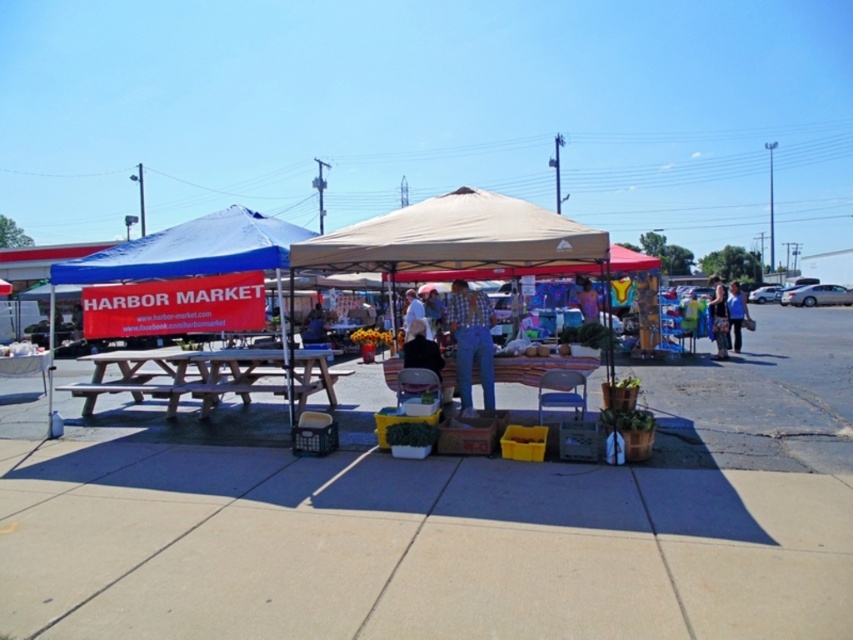
You are standing at the center of the market and want to find the light brown wooden picnic table at left. According to the coordinates provided, in which direction should you move to reach it?

The light brown wooden picnic table at left is located at coordinates point (184, 376), so you should move to the left direction to reach it.

You are a customer at the outdoor market and want to buy both the denim jacket at lower right and the blue fabric bag at lower right. If you need to carry them in one hand, which item should you choose to hold first to make it easier?

The denim jacket at lower right is bigger than the blue fabric bag at lower right, so you should hold the denim jacket at lower right first to manage the larger item with one hand.